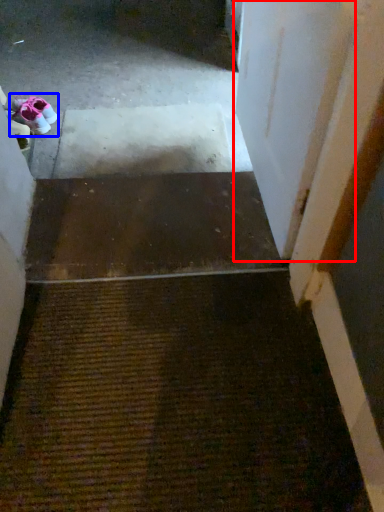
Question: Which object appears farthest to the camera in this image, door (highlighted by a red box) or footwear (highlighted by a blue box)?

Choices:
 (A) door
 (B) footwear

Answer: (B)